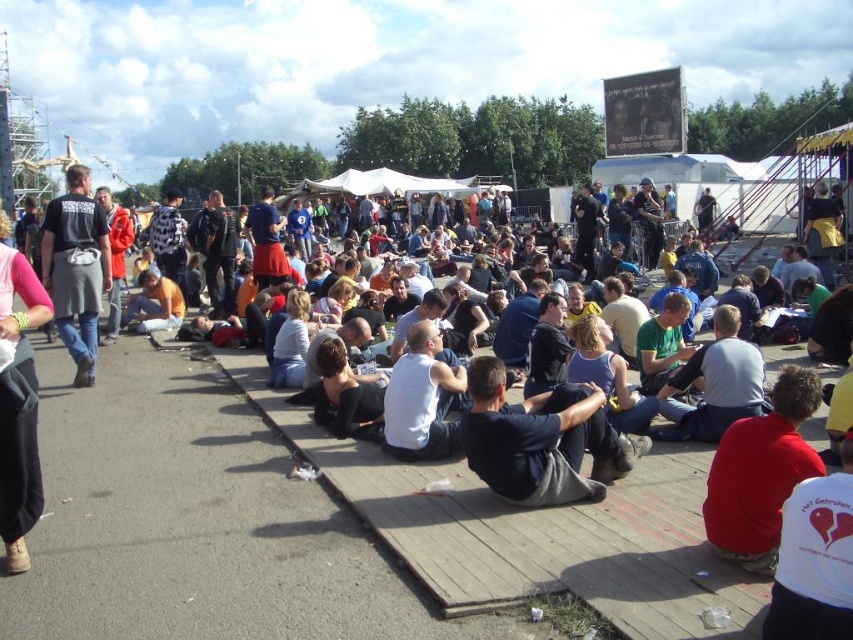
Based on the photo, you are a photographer trying to capture a candid shot of the dark blue fabric at center and the black fabric shirt at left. To ensure both are visible in the frame, you need to know their relative positions. Which fabric is positioned lower in the image?

The dark blue fabric at center is positioned below the black fabric shirt at left, so it is lower in the image.

You are standing at the edge of the wooden platform and want to move towards the point that is closer to you. Which point should you head towards, point (556, 467) or point (421, 353)?

You should head towards point (556, 467) because it is closer to the viewer than point (421, 353).

You are standing at the center of the platform and want to find the red cotton shirt at lower right. According to the coordinates provided, in which direction should you look to locate it?

The red cotton shirt at lower right is located at coordinates point (759, 472), which means it is positioned to the lower right from your current position at the center of the platform.